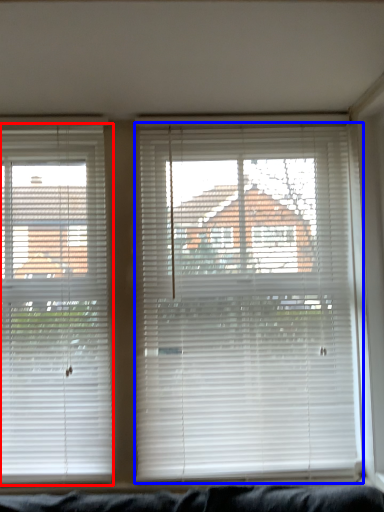
Question: Among these objects, which one is nearest to the camera, window blind (highlighted by a red box) or window blind (highlighted by a blue box)?

Choices:
 (A) window blind
 (B) window blind

Answer: (B)